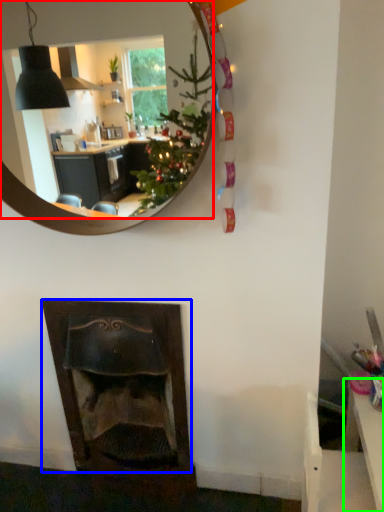
Question: Which is farther away from mirror (highlighted by a red box)? fireplace (highlighted by a blue box) or table (highlighted by a green box)?

Choices:
 (A) fireplace
 (B) table

Answer: (B)